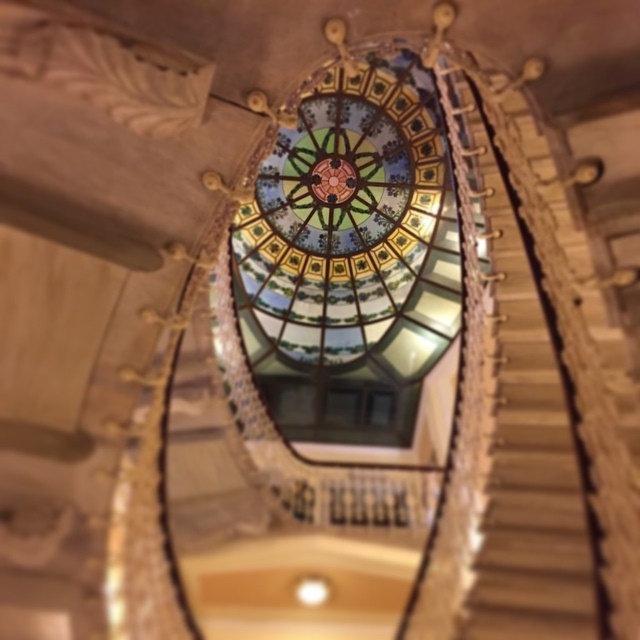
You are an architect designing a new building and want to ensure that the stained glass dome at center and wooden at center are proportionate. Based on the image, which object is significantly taller and should be adjusted to match the other?

The stained glass dome at center is much taller than the wooden at center, so adjustments should be made to reduce its height to match the wooden at center.

You are an architect assessing the structural integrity of the building. You notice the stained glass dome at center and the wooden at center. Which of these two elements is more likely to require reinforcement due to its size?

The stained glass dome at center has a larger size compared to wooden at center, so it is more likely to require reinforcement due to its size.

You are standing at the bottom of the staircase and want to know which object is wider between the stained glass dome at center and the wooden at center. Which one is wider?

The stained glass dome at center is wider than the wooden at center.